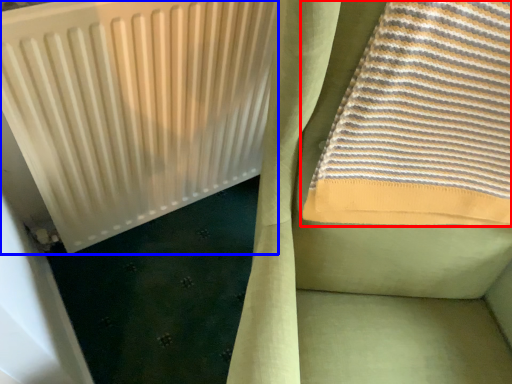
Question: Which object is closer to the camera taking this photo, towel (highlighted by a red box) or radiator (highlighted by a blue box)?

Choices:
 (A) towel
 (B) radiator

Answer: (A)